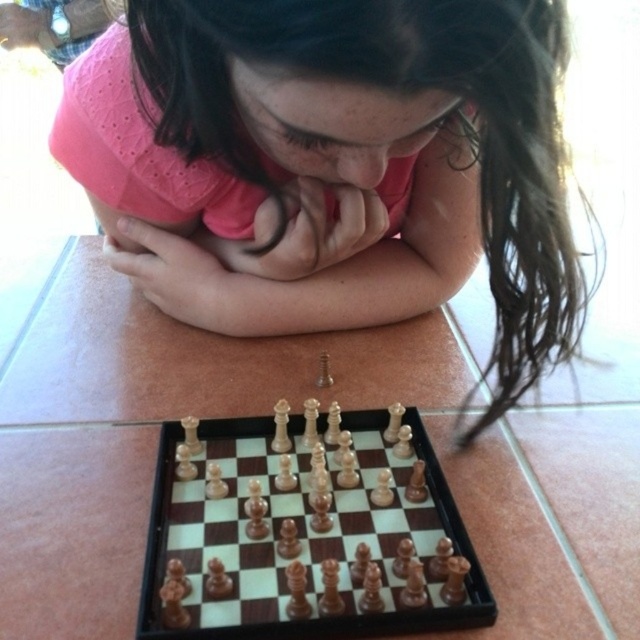
Is point (536, 173) positioned in front of point (403, 598)?

No, it is behind (403, 598).

Is pink matte shirt at center taller than wooden chess set at center?

Correct, pink matte shirt at center is much taller as wooden chess set at center.

Who is more distant from viewer, (419, 120) or (304, 518)?

The point (304, 518) is behind.

This screenshot has height=640, width=640. Identify the location of pink matte shirt at center. (339, 134).